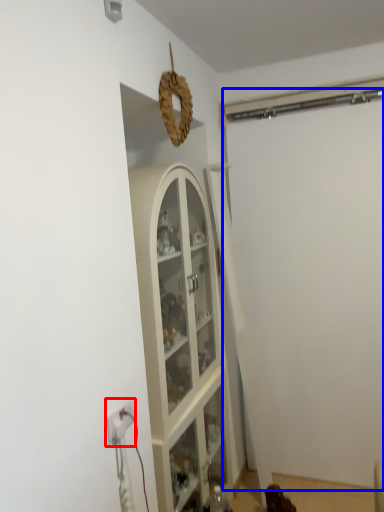
Question: Which point is further to the camera, electric outlet (highlighted by a red box) or garage door (highlighted by a blue box)?

Choices:
 (A) electric outlet
 (B) garage door

Answer: (B)